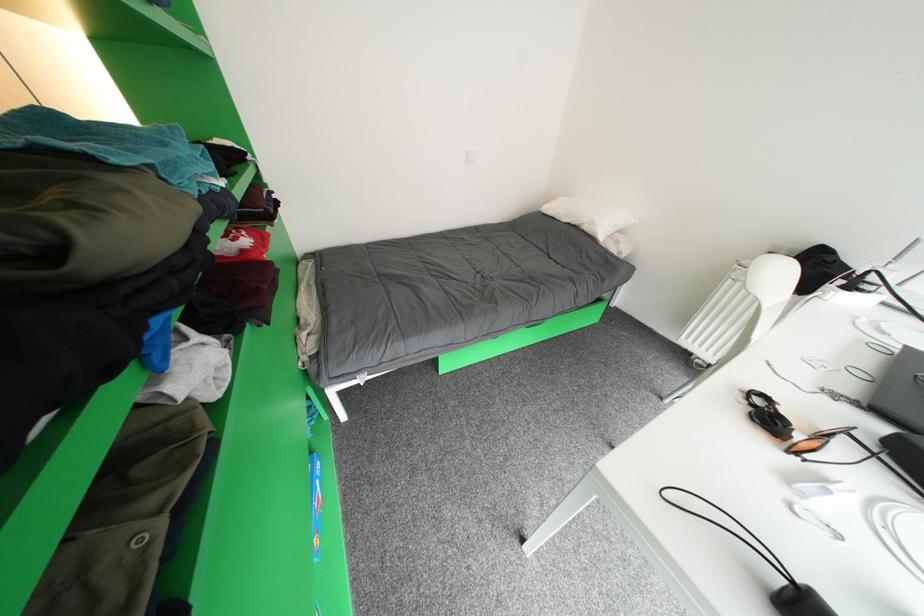
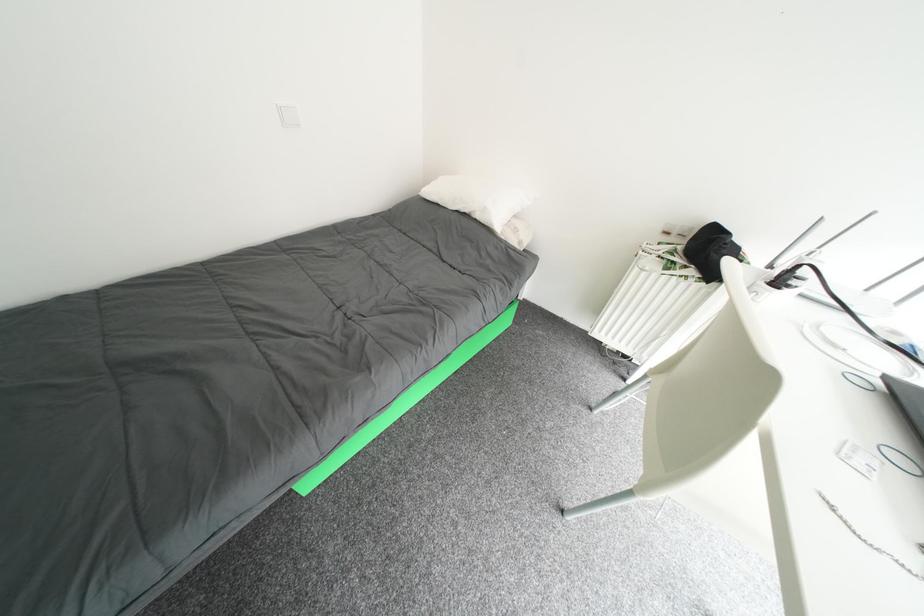
In a continuous first-person perspective shot, in which direction is the camera moving?

The cameraman walked toward right, forward.